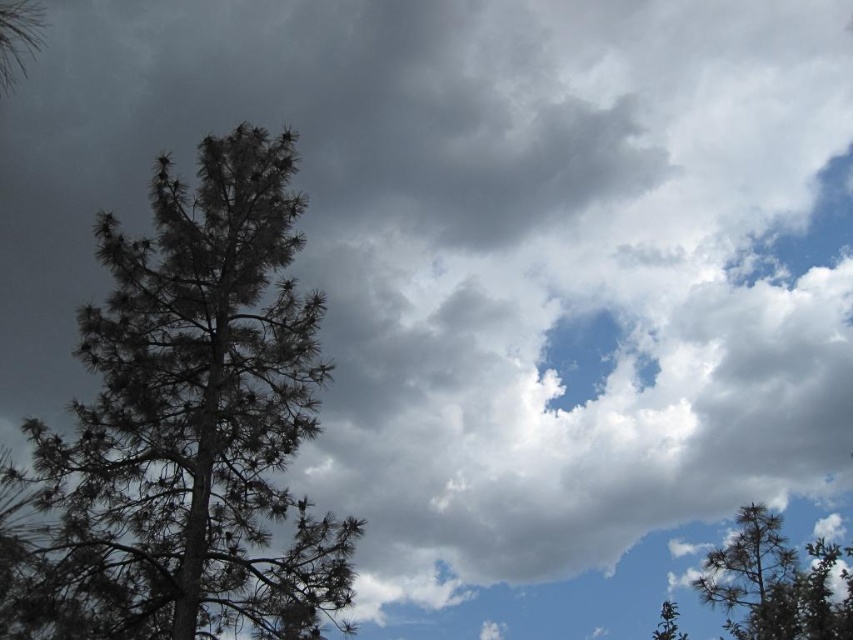
Can you confirm if dark green needles at left is shorter than green needle-like tree at lower right?

Indeed, dark green needles at left has a lesser height compared to green needle-like tree at lower right.

Is dark green needles at left positioned in front of green needle-like tree at lower right?

No, it is behind green needle-like tree at lower right.

The width and height of the screenshot is (853, 640). Describe the element at coordinates (186, 429) in the screenshot. I see `dark green needles at left` at that location.

You are a GUI agent. You are given a task and a screenshot of the screen. Output one action in this format:
    pyautogui.click(x=<x>, y=<y>)
    Task: Click on the dark green needles at left
    Image resolution: width=853 pixels, height=640 pixels.
    Given the screenshot: What is the action you would take?
    tap(186, 429)